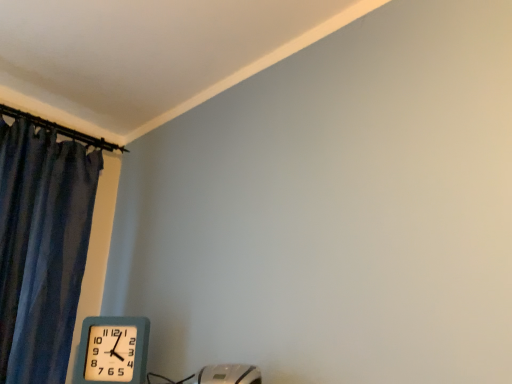
What do you see at coordinates (112, 350) in the screenshot?
I see `teal plastic wall clock at lower left` at bounding box center [112, 350].

Identify the location of teal plastic wall clock at lower left. (112, 350).

You are a GUI agent. You are given a task and a screenshot of the screen. Output one action in this format:
    pyautogui.click(x=<x>, y=<y>)
    Task: Click on the teal plastic wall clock at lower left
    Image resolution: width=512 pixels, height=384 pixels.
    Given the screenshot: What is the action you would take?
    pyautogui.click(x=112, y=350)